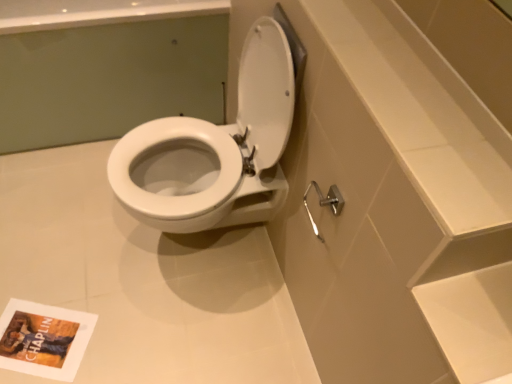
Find the location of a particular element. free spot above matte paper book cover at lower left (from a real-world perspective) is located at coordinates (33, 336).